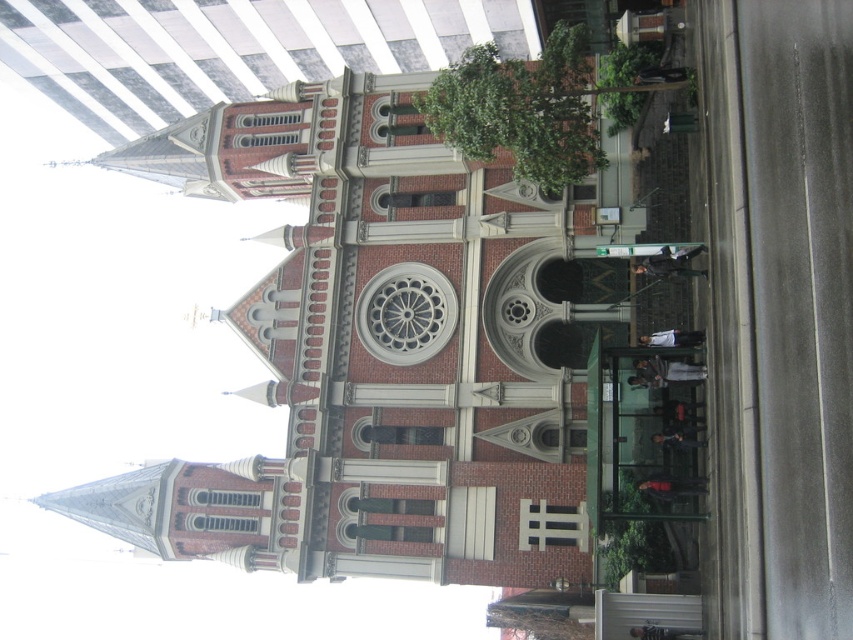
In the scene shown: You are standing in front of the historic church and want to take a photo. There are two points marked on your camera screen at coordinates point (444,321) and point (544,140). Which point is closer to your camera lens?

Point (444,321) is further to the camera than point (544,140), so the point closer to the camera lens is point (544,140).

You are a drone operator planning to fly a drone from the red brick church at center to the green leafy plant at upper center. The drone has a maximum flight range of 50 feet. Based on the scene, can the drone successfully reach the plant?

The red brick church at center and green leafy plant at upper center are 48.59 feet apart. Since the drone has a maximum flight range of 50 feet, it can successfully reach the plant as the distance is within its range.

You are an architect visiting the historic church. You notice two elements in the image. One is the red brick church at center and the other is the green leafy plant at upper center. Which of these two elements is bigger in size?

The red brick church at center is larger in size than the green leafy plant at upper center, so the red brick church at center is bigger.